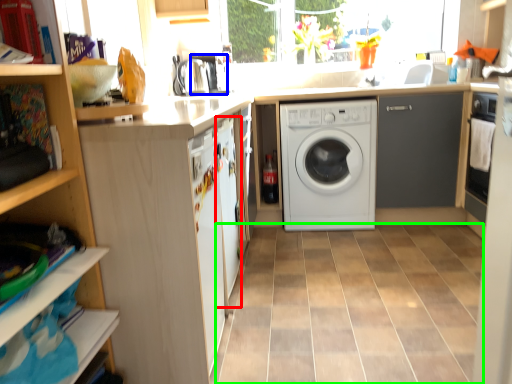
Question: Considering the real-world distances, which object is closest to screen door (highlighted by a red box)? coffee machine (highlighted by a blue box) or ceramic tile (highlighted by a green box).

Choices:
 (A) coffee machine
 (B) ceramic tile

Answer: (B)